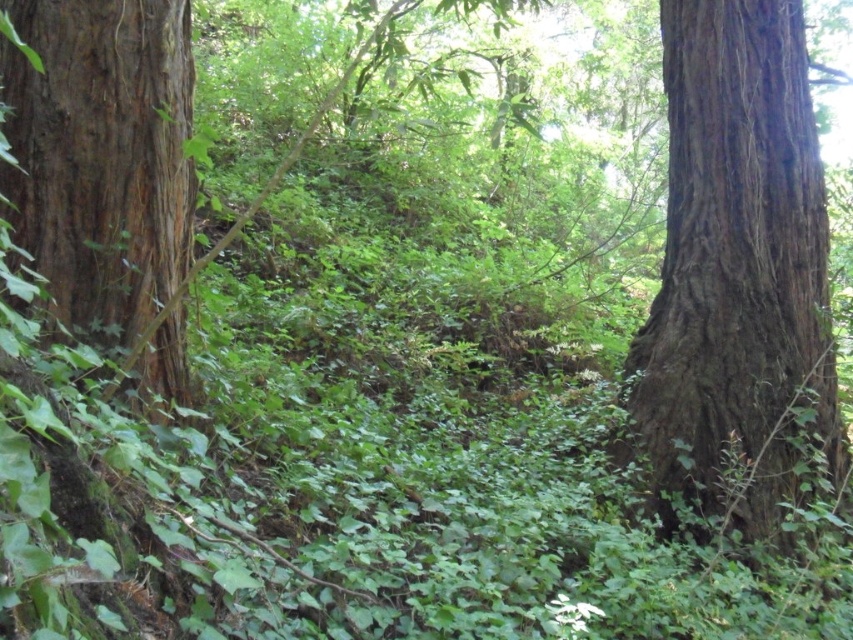
You are a hiker trying to navigate through the forest. You notice two tree trunks ahead of you. One is the brown rough bark tree trunk at right and the other is the smooth brown bark at left. Which tree trunk is wider? Please answer based on the scene description.

The brown rough bark tree trunk at right is wider than the smooth brown bark at left.

You are a hiker trying to identify the largest tree trunk in the forest. Which one between the brown rough bark tree trunk at right and the smooth brown bark at left is larger?

The brown rough bark tree trunk at right is bigger than the smooth brown bark at left, so it is the larger one.

You are a hiker carrying a 2 meter long wooden plank. You want to place it between the brown rough bark tree trunk at right and the smooth brown bark at left. Will the plank fit between them?

The distance between the brown rough bark tree trunk at right and the smooth brown bark at left is 2.26 meters. Since the plank is 2 meters long, it will fit between them with some space to spare.